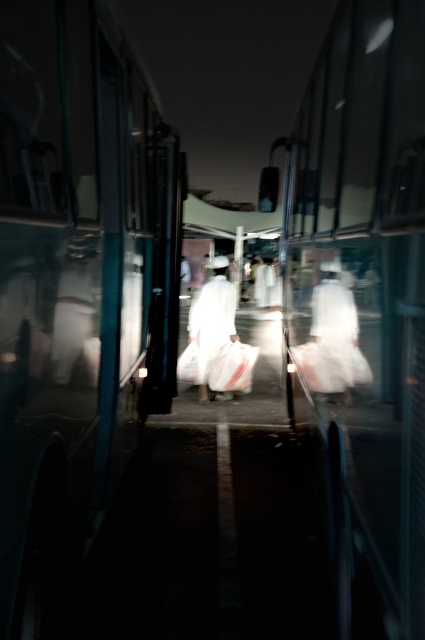
Question: Which object appears closest to the camera in this image?

Choices:
 (A) shiny metallic bus at center
 (B) white matte robe at center
 (C) white cotton robe at center
 (D) metallic silver bus at center

Answer: (A)

Question: Is shiny metallic bus at center positioned before white cotton robe at center?

Choices:
 (A) yes
 (B) no

Answer: (A)

Question: Is metallic silver bus at center to the right of shiny metallic bus at center from the viewer's perspective?

Choices:
 (A) yes
 (B) no

Answer: (B)

Question: Estimate the real-world distances between objects in this image. Which object is farther from the metallic silver bus at center?

Choices:
 (A) shiny metallic bus at center
 (B) white matte robe at center
 (C) white cotton robe at center

Answer: (C)

Question: Can you confirm if shiny metallic bus at center is positioned below white matte robe at center?

Choices:
 (A) yes
 (B) no

Answer: (B)

Question: Which object is farther from the camera taking this photo?

Choices:
 (A) white cotton robe at center
 (B) shiny metallic bus at center
 (C) white matte robe at center
 (D) metallic silver bus at center

Answer: (A)